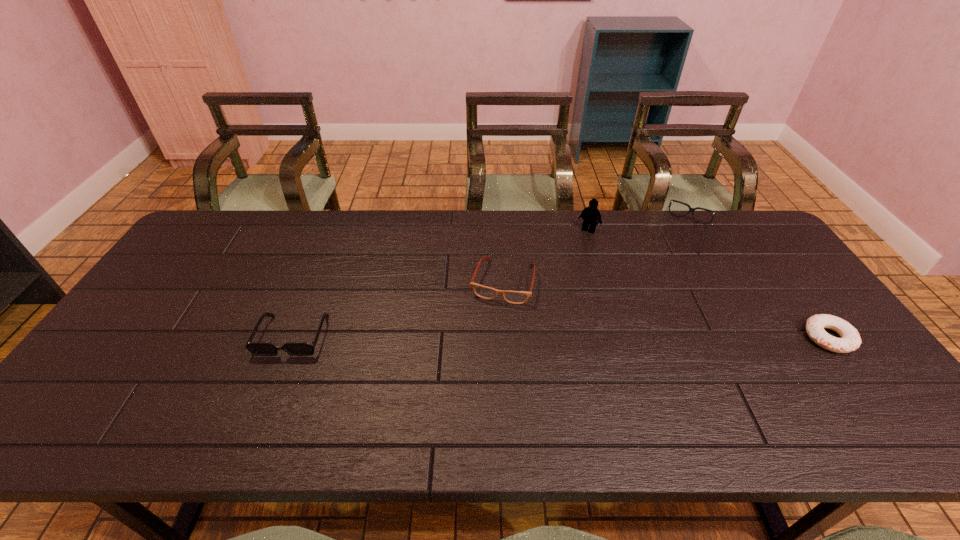
Locate an element on the screen. The width and height of the screenshot is (960, 540). vacant space that's between the left spectacles and the sunglasses is located at coordinates (397, 308).

You are a GUI agent. You are given a task and a screenshot of the screen. Output one action in this format:
    pyautogui.click(x=<x>, y=<y>)
    Task: Click on the vacant space that's between the left spectacles and the leftmost object
    
    Given the screenshot: What is the action you would take?
    pyautogui.click(x=397, y=308)

Image resolution: width=960 pixels, height=540 pixels. Find the location of `free space between the tallest object and the nearer spectacles`. free space between the tallest object and the nearer spectacles is located at coordinates (545, 255).

The width and height of the screenshot is (960, 540). Identify the location of free point between the fourth object from right to left and the farther spectacles. (592, 257).

This screenshot has height=540, width=960. I want to click on vacant point located between the sunglasses and the rightmost object, so pyautogui.click(x=561, y=336).

Find the location of a particular element. This screenshot has height=540, width=960. empty location between the sunglasses and the second object from right to left is located at coordinates (488, 284).

Locate an element on the screen. vacant space that is in between the second object from right to left and the nearer spectacles is located at coordinates (592, 257).

At what (x,y) coordinates should I click in order to perform the action: click on free spot between the shortest object and the sunglasses. Please return your answer as a coordinate pair (x, y). Looking at the image, I should click on (561, 336).

Find the location of a particular element. unoccupied area between the shortest object and the second object from left to right is located at coordinates (665, 309).

This screenshot has width=960, height=540. Find the location of `the third closest object to the nearer spectacles`. the third closest object to the nearer spectacles is located at coordinates (692, 210).